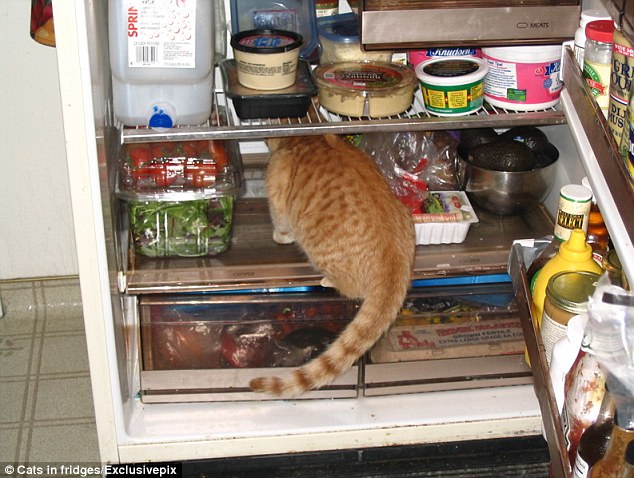
At what (x,y) coordinates should I click in order to perform the action: click on wall. Please return your answer as a coordinate pair (x, y). The image size is (634, 478). Looking at the image, I should click on (52, 109).